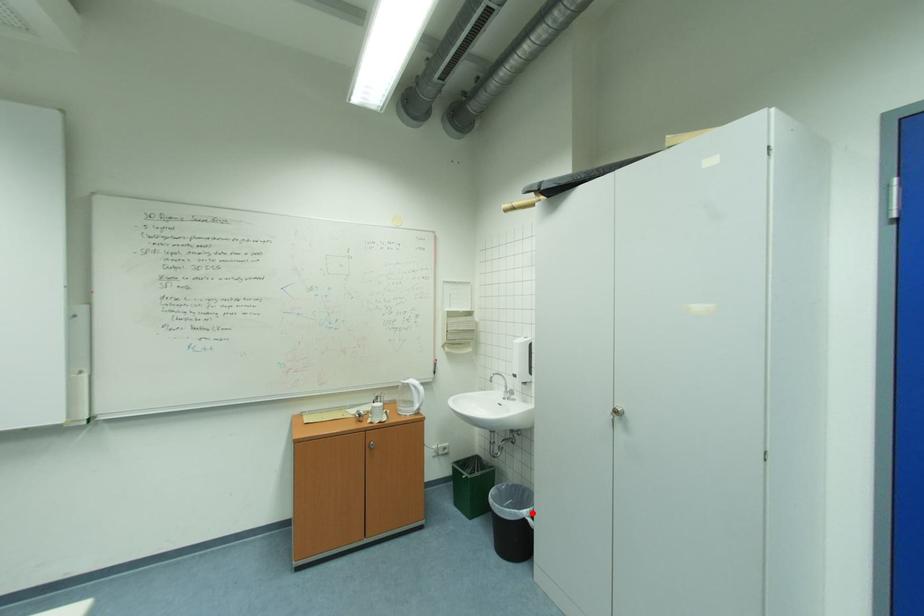
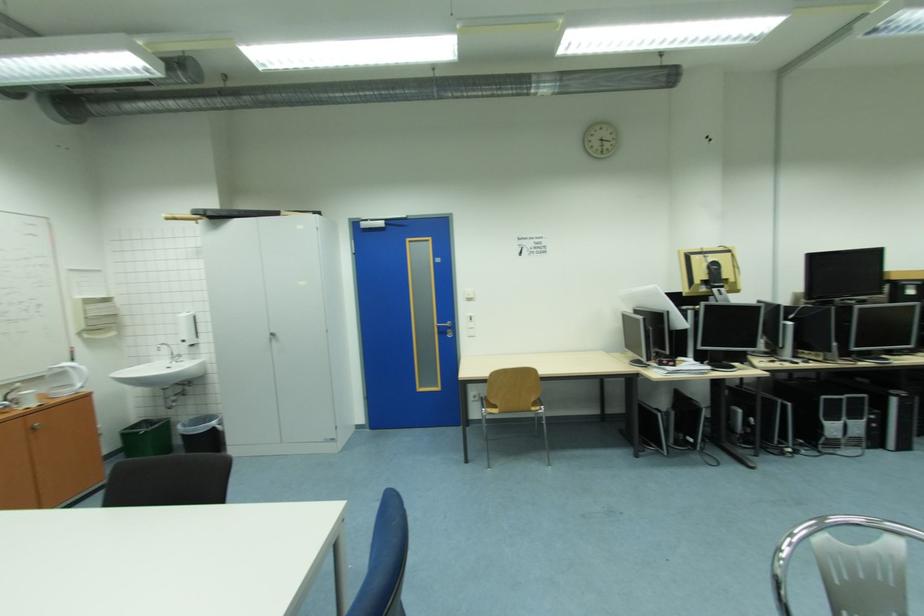
Find the pixel in the second image that matches the highlighted location in the first image.

(220, 424)